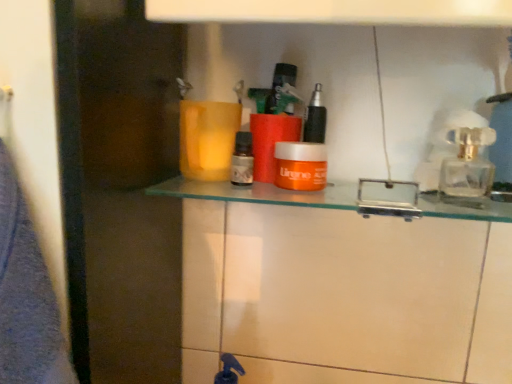
Question: From a real-world perspective, is brown glass bottle at center, the second toiletry positioned from the right, above or below orange plastic container at center?

Choices:
 (A) below
 (B) above

Answer: (B)

Question: Is brown glass bottle at center, the second toiletry positioned from the right, situated inside orange plastic container at center or outside?

Choices:
 (A) outside
 (B) inside

Answer: (A)

Question: Which of these objects is positioned closest to the orange matte jar at center, the 1th toiletry in the right-to-left sequence?

Choices:
 (A) transparent glass perfume bottle at upper right
 (B) brown glass bottle at center, the second toiletry positioned from the right
 (C) orange plastic container at center
 (D) transparent glass door at left
 (E) orange matte jar at center

Answer: (E)

Question: Considering the real-world distances, which object is closest to the transparent glass perfume bottle at upper right?

Choices:
 (A) brown glass bottle at center, the second toiletry positioned from the right
 (B) orange matte jar at center, the second toiletry positioned from the left
 (C) transparent glass door at left
 (D) orange matte jar at center
 (E) orange plastic container at center

Answer: (E)